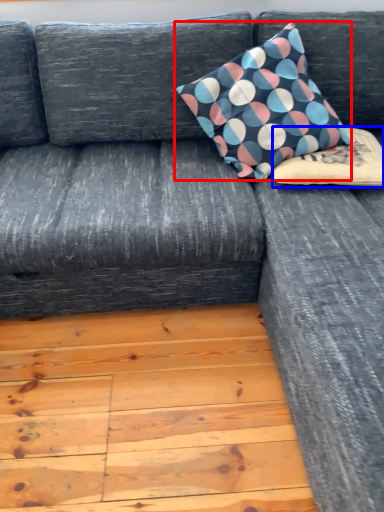
Question: Which object is closer to the camera taking this photo, pillow (highlighted by a red box) or pillow (highlighted by a blue box)?

Choices:
 (A) pillow
 (B) pillow

Answer: (A)